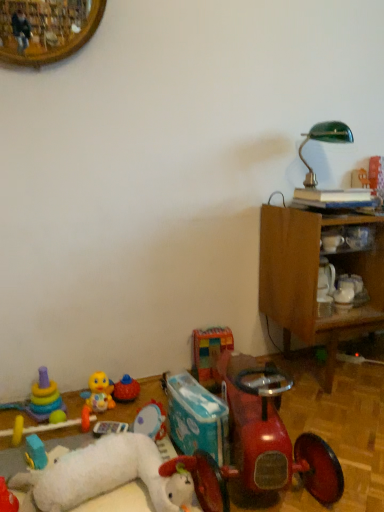
Locate an element on the screen. The image size is (384, 512). vacant space in multicolored plastic stacking rings at lower left, which is the 4th toy in left-to-right order (from a real-world perspective) is located at coordinates (63, 432).